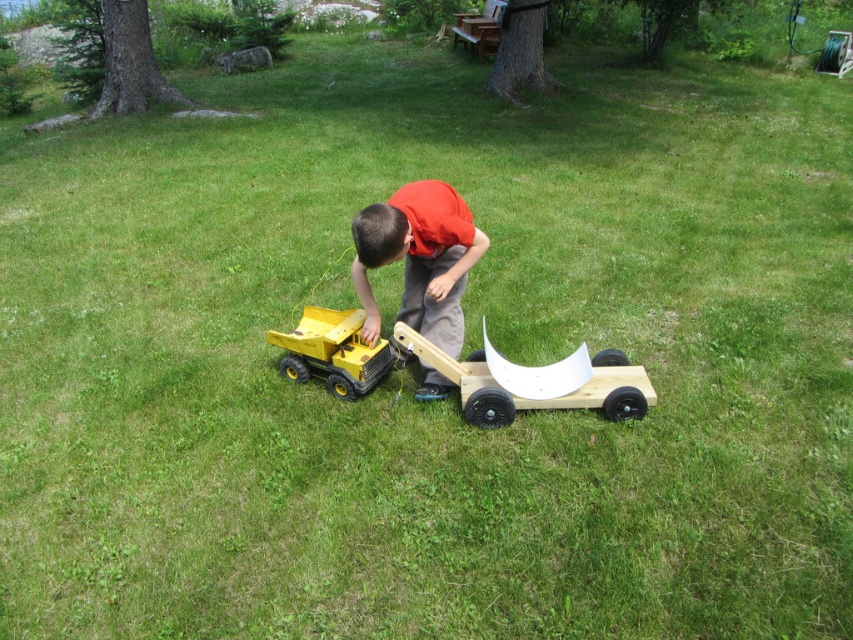
Question: Can you confirm if wooden cart at center is positioned to the right of yellow plastic toy truck at lower center?

Choices:
 (A) yes
 (B) no

Answer: (A)

Question: Which of the following is the farthest from the observer?

Choices:
 (A) orange cotton shirt at center
 (B) yellow plastic toy truck at lower center
 (C) wooden cart at center

Answer: (B)

Question: Can you confirm if orange cotton shirt at center is smaller than yellow plastic toy truck at lower center?

Choices:
 (A) no
 (B) yes

Answer: (A)

Question: Is orange cotton shirt at center to the left of wooden cart at center from the viewer's perspective?

Choices:
 (A) no
 (B) yes

Answer: (B)

Question: Among these objects, which one is nearest to the camera?

Choices:
 (A) wooden cart at center
 (B) orange cotton shirt at center
 (C) yellow plastic toy truck at lower center

Answer: (B)

Question: Among these points, which one is farthest from the camera?

Choices:
 (A) (432, 236)
 (B) (357, 337)

Answer: (B)